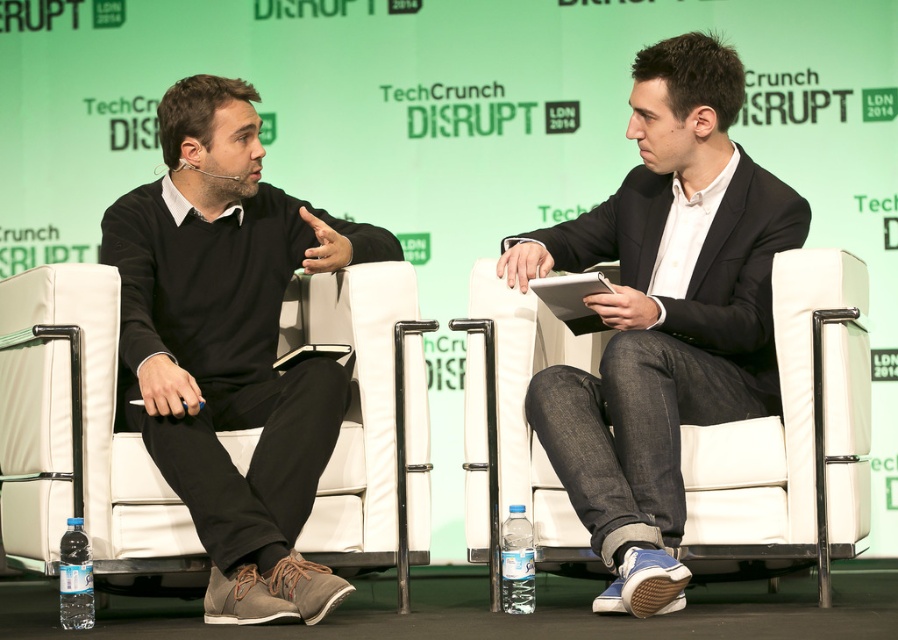
Question: Is white leather chair at left thinner than white leather chair at center?

Choices:
 (A) yes
 (B) no

Answer: (B)

Question: Which point appears farthest from the camera in this image?

Choices:
 (A) [577, 529]
 (B) [318, 324]

Answer: (B)

Question: Is white leather chair at left wider than white leather chair at center?

Choices:
 (A) no
 (B) yes

Answer: (B)

Question: Can you confirm if white leather chair at left is thinner than white leather chair at center?

Choices:
 (A) no
 (B) yes

Answer: (A)

Question: Which of the following is the farthest from the observer?

Choices:
 (A) white leather chair at center
 (B) white leather chair at left

Answer: (A)